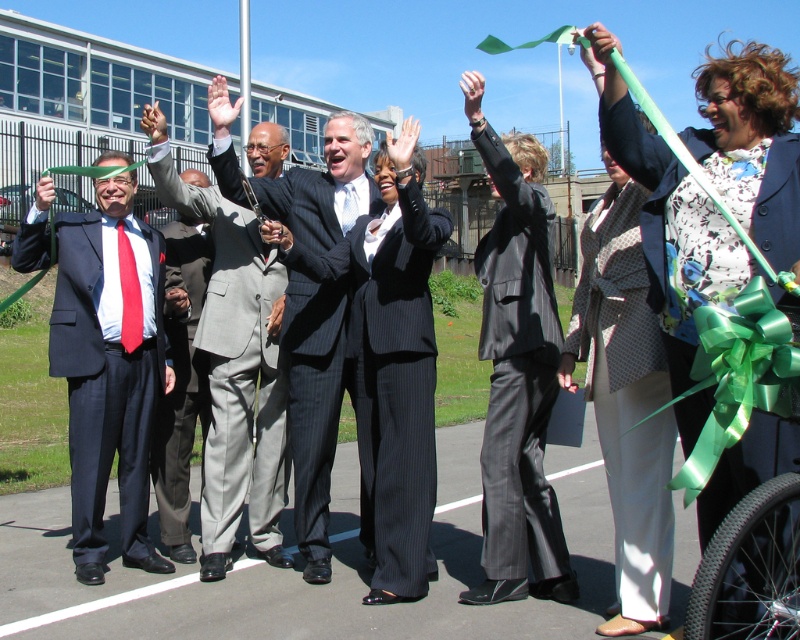
Question: Which point is closer to the camera taking this photo?

Choices:
 (A) (560, 536)
 (B) (97, 205)
 (C) (413, 474)

Answer: (A)

Question: Which point is farther to the camera?

Choices:
 (A) (244, 208)
 (B) (420, 484)
 (C) (162, 502)

Answer: (C)

Question: Does matte black suit at left lie in front of black pinstripe suit at center?

Choices:
 (A) yes
 (B) no

Answer: (B)

Question: Observing the image, what is the correct spatial positioning of black leather suit at center in reference to white textured pants at center?

Choices:
 (A) above
 (B) below

Answer: (A)

Question: Which of these objects is positioned farthest from the white textured pants at center?

Choices:
 (A) light gray suit at center
 (B) gray wool suit at center

Answer: (B)

Question: Does black leather suit at center appear over white textured pants at center?

Choices:
 (A) yes
 (B) no

Answer: (A)